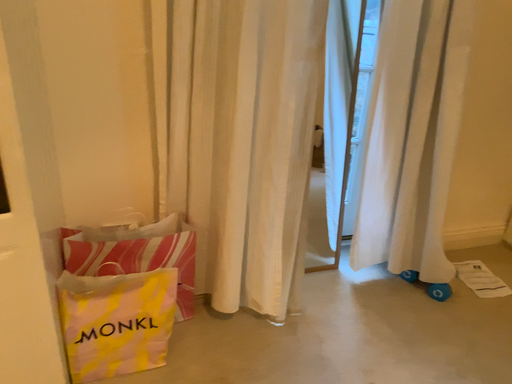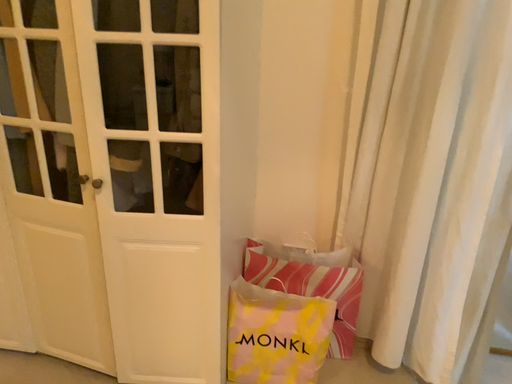
Question: How did the camera likely rotate when shooting the video?

Choices:
 (A) rotated right
 (B) rotated left

Answer: (B)